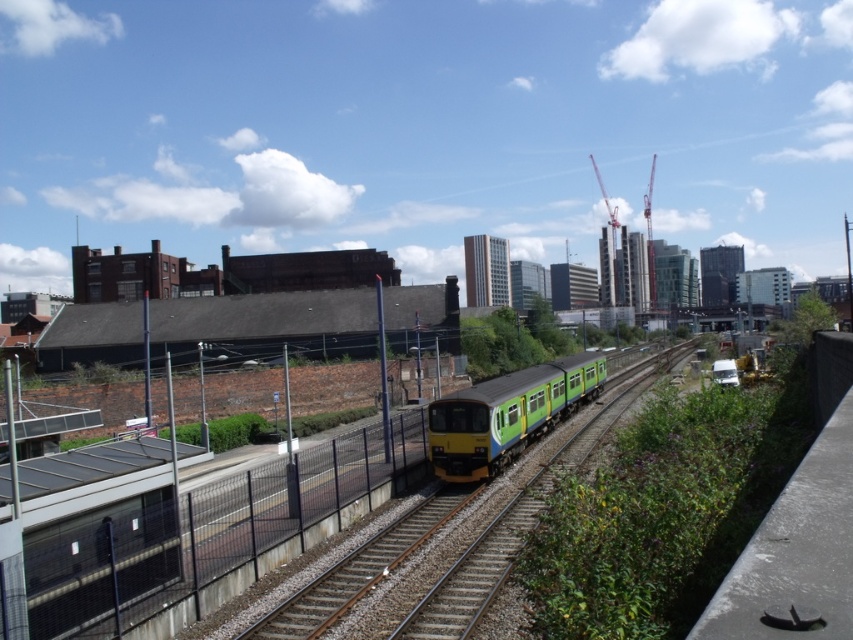
Is point (456, 416) positioned in front of point (309, 636)?

No, (456, 416) is behind (309, 636).

Which is above, green matte train at center or brown gravel train track at center?

green matte train at center is above.

What do you see at coordinates (508, 413) in the screenshot? I see `green matte train at center` at bounding box center [508, 413].

Locate an element on the screen. This screenshot has height=640, width=853. green matte train at center is located at coordinates (508, 413).